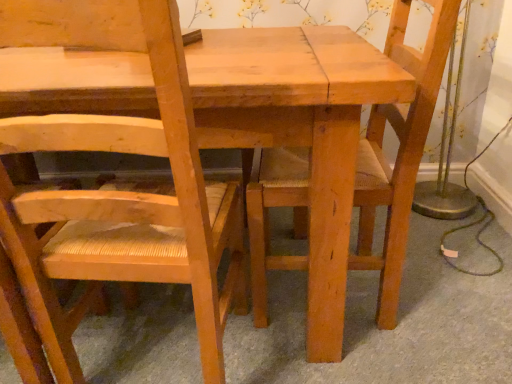
This screenshot has width=512, height=384. I want to click on empty space that is to the right of natural wood chair at center, which ranks as the 1th chair in right-to-left order, so click(x=449, y=277).